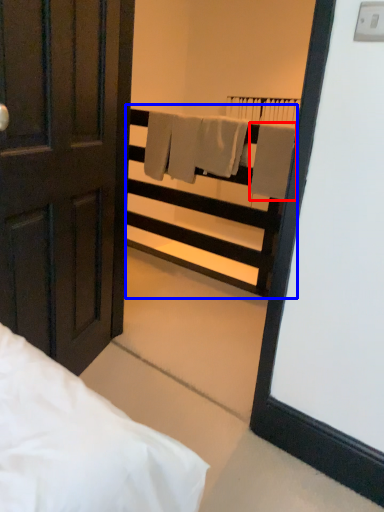
Question: Among these objects, which one is farthest to the camera, bath towel (highlighted by a red box) or balustrade (highlighted by a blue box)?

Choices:
 (A) bath towel
 (B) balustrade

Answer: (B)